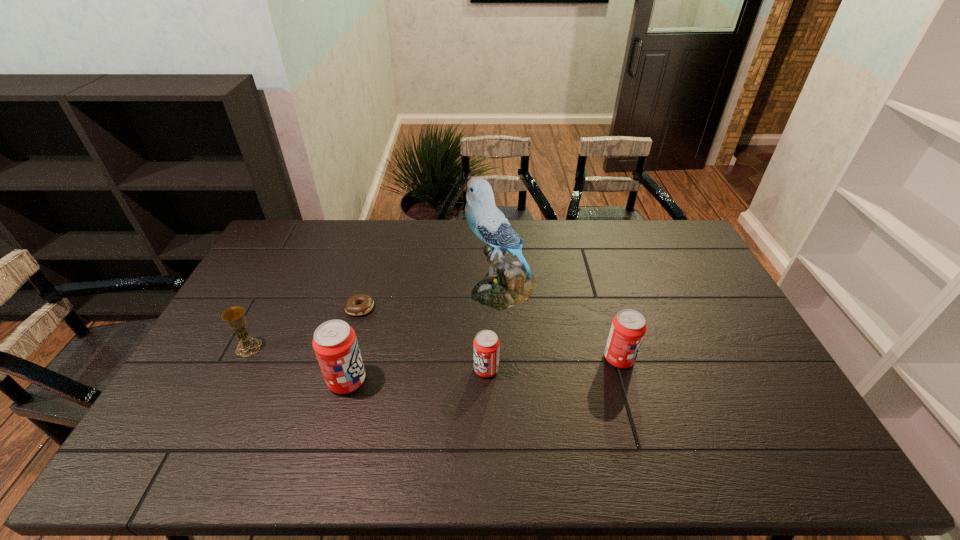
I want to click on vacant area at the far edge, so click(366, 248).

The height and width of the screenshot is (540, 960). Identify the location of vacant space at the near edge. (262, 420).

Where is `vacant space at the near left corner of the desktop`? The image size is (960, 540). vacant space at the near left corner of the desktop is located at coordinates (206, 409).

The width and height of the screenshot is (960, 540). Identify the location of free location at the near right corner. (741, 397).

Find the location of a particular element. free spot between the second soda can from left to right and the leftmost object is located at coordinates (368, 358).

Find the location of `vacant area that lies between the parakeet and the shortest soda can`. vacant area that lies between the parakeet and the shortest soda can is located at coordinates (494, 329).

This screenshot has width=960, height=540. I want to click on free spot between the chalice and the shortest object, so click(x=304, y=327).

Find the location of a particular element. The height and width of the screenshot is (540, 960). vacant point located between the parakeet and the leftmost soda can is located at coordinates (424, 335).

The height and width of the screenshot is (540, 960). Find the location of `free area in between the rightmost soda can and the parakeet`. free area in between the rightmost soda can and the parakeet is located at coordinates (561, 324).

At what (x,y) coordinates should I click in order to perform the action: click on empty space between the rightmost soda can and the shortest soda can. Please return your answer as a coordinate pair (x, y). Looking at the image, I should click on (553, 363).